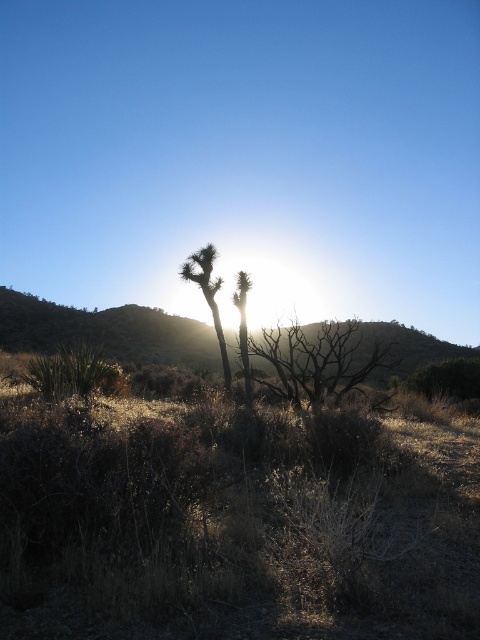
Between point (183, 273) and point (245, 282), which one is positioned behind?

The point (183, 273) is more distant.

Does green leafy tree at center lie behind green spiky cactus at center?

No, it is not.

Who is more distant from viewer, (217, 314) or (240, 336)?

Positioned behind is point (217, 314).

At what (x,y) coordinates should I click in order to perform the action: click on green leafy tree at center. Please return your answer as a coordinate pair (x, y). Looking at the image, I should click on (208, 296).

Consider the image. Who is shorter, brown/dry wood at center or green leafy tree at center?

brown/dry wood at center is shorter.

Is point (338, 372) positioned after point (211, 308)?

No.

Who is more forward, (x=331, y=364) or (x=190, y=268)?

Point (x=331, y=364) is more forward.

Image resolution: width=480 pixels, height=640 pixels. Identify the location of brown/dry wood at center. (316, 360).

Is brown/dry wood at center to the left of green spiky cactus at center from the viewer's perspective?

Incorrect, brown/dry wood at center is not on the left side of green spiky cactus at center.

Is the position of brown/dry wood at center less distant than that of green spiky cactus at center?

That is True.

Between point (328, 323) and point (244, 324), which one is positioned in front?

Point (244, 324) is more forward.

At what (x,y) coordinates should I click in order to perform the action: click on brown/dry wood at center. Please return your answer as a coordinate pair (x, y). Looking at the image, I should click on (316, 360).